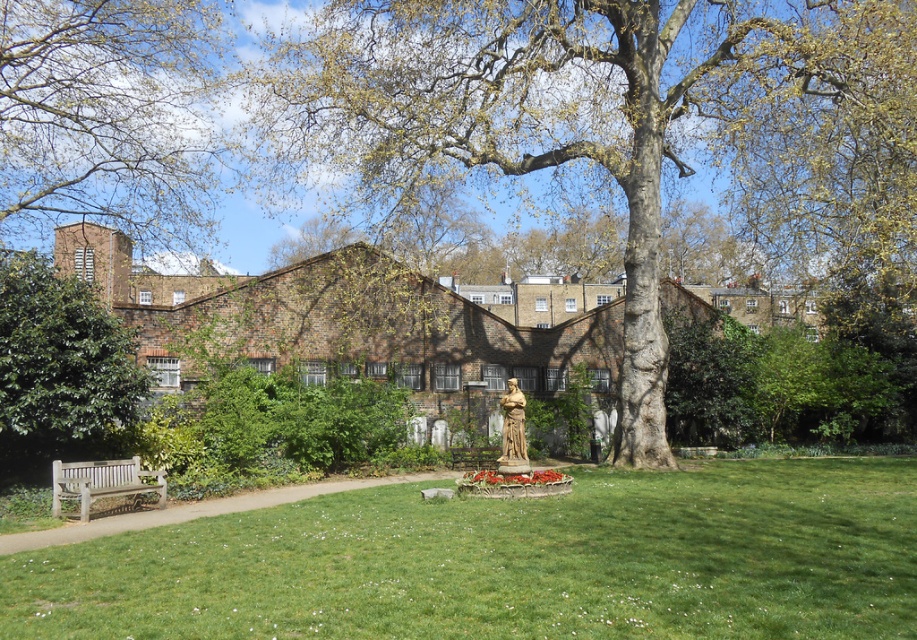
You are planning to take a photo of the smooth brown tree trunk at center and the green leafy tree at upper left. Which tree should you focus on first if you want to capture the taller one in your shot?

The smooth brown tree trunk at center is taller than the green leafy tree at upper left, so you should focus on the smooth brown tree trunk at center first.

You are standing in the park and want to take a photo of the smooth brown tree trunk at center and the green leafy tree at upper left. Which tree should you focus on first to ensure both are in the frame?

You should focus on the smooth brown tree trunk at center first because it is closer to you than the green leafy tree at upper left, so it will be in the foreground of the photo.